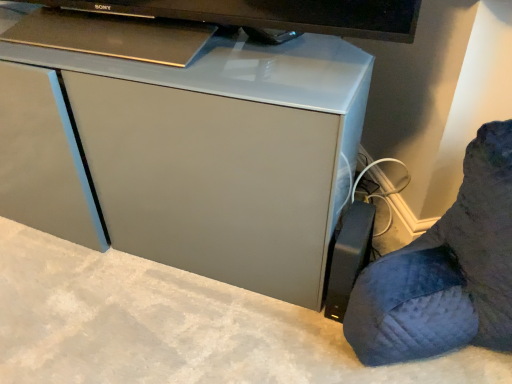
What do you see at coordinates (445, 271) in the screenshot? I see `black plastic power strip at lower right` at bounding box center [445, 271].

In order to click on black plastic power strip at lower right in this screenshot , I will do `click(445, 271)`.

In order to face matte gray cabinet at center, should I rotate leftwards or rightwards?

It's best to rotate left around 17.000 degrees.

What is the approximate width of matte gray cabinet at center?

It is 13.73 inches.

This screenshot has width=512, height=384. Identify the location of matte gray cabinet at center. (218, 153).

Image resolution: width=512 pixels, height=384 pixels. What do you see at coordinates (218, 153) in the screenshot? I see `matte gray cabinet at center` at bounding box center [218, 153].

I want to click on black plastic power strip at lower right, so click(445, 271).

Does matte gray cabinet at center appear on the right side of black plastic power strip at lower right?

No.

Does matte gray cabinet at center come behind black plastic power strip at lower right?

Yes.

Is point (66, 70) closer to viewer compared to point (367, 307)?

No, (66, 70) is behind (367, 307).

From the image's perspective, is matte gray cabinet at center above black plastic power strip at lower right?

Yes, from the image's perspective, matte gray cabinet at center is over black plastic power strip at lower right.

From a real-world perspective, is matte gray cabinet at center physically located above or below black plastic power strip at lower right?

matte gray cabinet at center is above black plastic power strip at lower right.

Which of these two, matte gray cabinet at center or black plastic power strip at lower right, is thinner?

With smaller width is matte gray cabinet at center.

Which of these two, matte gray cabinet at center or black plastic power strip at lower right, stands taller?

With more height is matte gray cabinet at center.

Considering the sizes of objects matte gray cabinet at center and black plastic power strip at lower right in the image provided, who is bigger, matte gray cabinet at center or black plastic power strip at lower right?

matte gray cabinet at center.

Is matte gray cabinet at center completely or partially outside of black plastic power strip at lower right?

Indeed, matte gray cabinet at center is completely outside black plastic power strip at lower right.

Is matte gray cabinet at center beside black plastic power strip at lower right?

There is a gap between matte gray cabinet at center and black plastic power strip at lower right.

Could you tell me if matte gray cabinet at center is facing black plastic power strip at lower right?

No.

How different are the orientations of matte gray cabinet at center and black plastic power strip at lower right in degrees?

matte gray cabinet at center and black plastic power strip at lower right are facing 2.58 degrees away from each other.

You are a GUI agent. You are given a task and a screenshot of the screen. Output one action in this format:
    pyautogui.click(x=<x>, y=<y>)
    Task: Click on the furniture below the matte gray cabinet at center (from the image's perspective)
    The width and height of the screenshot is (512, 384).
    Given the screenshot: What is the action you would take?
    pyautogui.click(x=445, y=271)

Considering the relative positions of black plastic power strip at lower right and matte gray cabinet at center in the image provided, is black plastic power strip at lower right to the right of matte gray cabinet at center from the viewer's perspective?

Correct, you'll find black plastic power strip at lower right to the right of matte gray cabinet at center.

Is the position of black plastic power strip at lower right less distant than that of matte gray cabinet at center?

Yes.

Which is less distant, [490,328] or [205,130]?

Positioned in front is point [205,130].

Consider the image. From the image's perspective, would you say black plastic power strip at lower right is shown under matte gray cabinet at center?

Yes, from the image's perspective, black plastic power strip at lower right is below matte gray cabinet at center.

From a real-world perspective, does black plastic power strip at lower right stand above matte gray cabinet at center?

Incorrect, from a real-world perspective, black plastic power strip at lower right is lower than matte gray cabinet at center.

Which object is wider, black plastic power strip at lower right or matte gray cabinet at center?

With larger width is black plastic power strip at lower right.

Who is shorter, black plastic power strip at lower right or matte gray cabinet at center?

black plastic power strip at lower right.

Is black plastic power strip at lower right bigger or smaller than matte gray cabinet at center?

In the image, black plastic power strip at lower right appears to be smaller than matte gray cabinet at center.

Is matte gray cabinet at center completely or partially inside black plastic power strip at lower right?

No, matte gray cabinet at center is not a part of black plastic power strip at lower right.

Is black plastic power strip at lower right touching matte gray cabinet at center?

No.

Is black plastic power strip at lower right oriented towards matte gray cabinet at center?

No, black plastic power strip at lower right is not facing towards matte gray cabinet at center.

How different are the orientations of black plastic power strip at lower right and matte gray cabinet at center in degrees?

There is a 2.58-degree angle between the facing directions of black plastic power strip at lower right and matte gray cabinet at center.

Where is `furniture below the matte gray cabinet at center (from a real-world perspective)`? Image resolution: width=512 pixels, height=384 pixels. furniture below the matte gray cabinet at center (from a real-world perspective) is located at coordinates (445, 271).

You are a GUI agent. You are given a task and a screenshot of the screen. Output one action in this format:
    pyautogui.click(x=<x>, y=<y>)
    Task: Click on the furniture located below the matte gray cabinet at center (from the image's perspective)
    
    Given the screenshot: What is the action you would take?
    pyautogui.click(x=445, y=271)

Locate an element on the screen. Image resolution: width=512 pixels, height=384 pixels. computer desk that is on the left side of black plastic power strip at lower right is located at coordinates (218, 153).